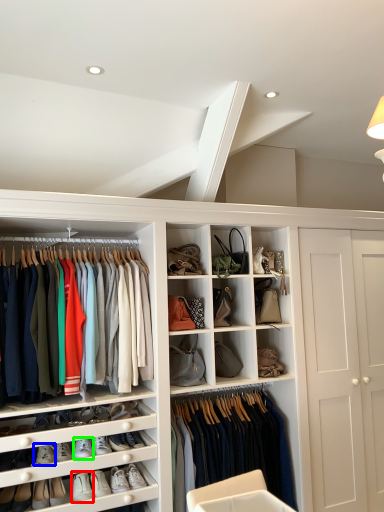
Question: Estimate the real-world distances between objects in this image. Which object is closer to footwear (highlighted by a red box), footwear (highlighted by a blue box) or footwear (highlighted by a green box)?

Choices:
 (A) footwear
 (B) footwear

Answer: (B)